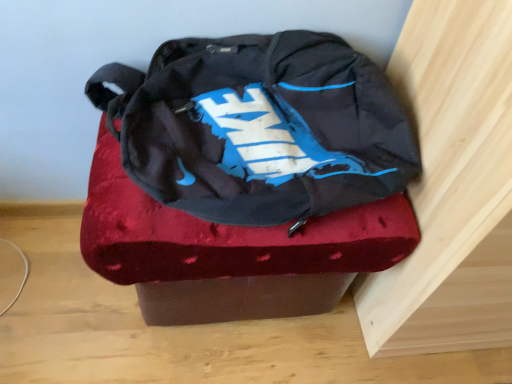
Question: Does velvet-like red ottoman at center have a lesser width compared to matte black backpack at center?

Choices:
 (A) no
 (B) yes

Answer: (A)

Question: Is the depth of velvet-like red ottoman at center greater than that of matte black backpack at center?

Choices:
 (A) yes
 (B) no

Answer: (A)

Question: From the image's perspective, would you say velvet-like red ottoman at center is shown under matte black backpack at center?

Choices:
 (A) yes
 (B) no

Answer: (A)

Question: Does velvet-like red ottoman at center appear on the left side of matte black backpack at center?

Choices:
 (A) no
 (B) yes

Answer: (B)

Question: Considering the relative positions of velvet-like red ottoman at center and matte black backpack at center in the image provided, is velvet-like red ottoman at center in front of matte black backpack at center?

Choices:
 (A) yes
 (B) no

Answer: (B)

Question: Considering the relative positions of velvet-like red ottoman at center and matte black backpack at center in the image provided, is velvet-like red ottoman at center to the right of matte black backpack at center from the viewer's perspective?

Choices:
 (A) yes
 (B) no

Answer: (B)

Question: Is matte black backpack at center oriented away from velvet-like red ottoman at center?

Choices:
 (A) no
 (B) yes

Answer: (A)

Question: Does matte black backpack at center have a greater width compared to velvet-like red ottoman at center?

Choices:
 (A) no
 (B) yes

Answer: (A)

Question: Can you confirm if matte black backpack at center is shorter than velvet-like red ottoman at center?

Choices:
 (A) yes
 (B) no

Answer: (B)

Question: From the image's perspective, is matte black backpack at center above velvet-like red ottoman at center?

Choices:
 (A) no
 (B) yes

Answer: (B)

Question: Is matte black backpack at center thinner than velvet-like red ottoman at center?

Choices:
 (A) yes
 (B) no

Answer: (A)

Question: From a real-world perspective, is matte black backpack at center over velvet-like red ottoman at center?

Choices:
 (A) yes
 (B) no

Answer: (A)

Question: From a real-world perspective, relative to velvet-like red ottoman at center, is matte black backpack at center vertically above or below?

Choices:
 (A) below
 (B) above

Answer: (B)